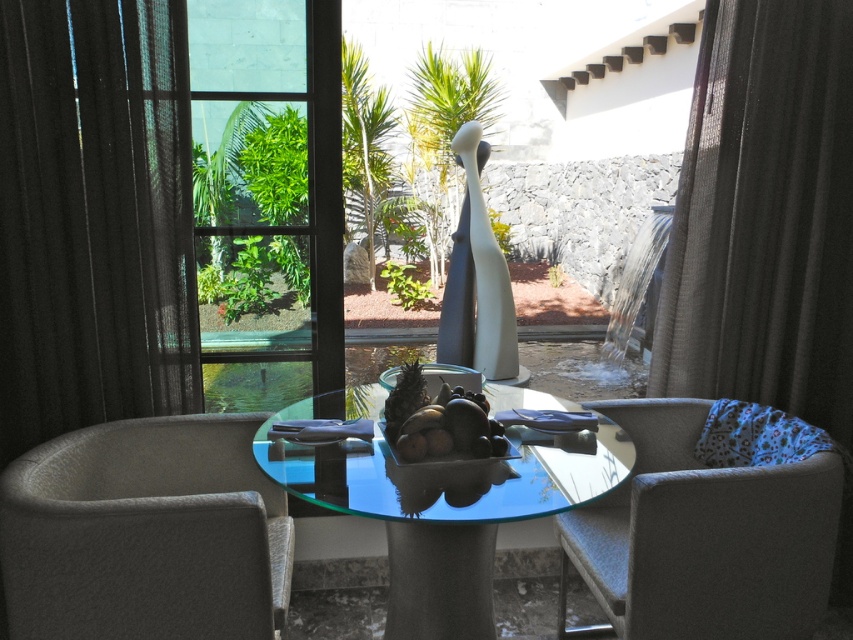
Based on the photo, is black sheer curtain at left bigger than transparent glass door at left?

No, black sheer curtain at left is not bigger than transparent glass door at left.

Is black sheer curtain at left positioned behind transparent glass door at left?

No.

You are a GUI agent. You are given a task and a screenshot of the screen. Output one action in this format:
    pyautogui.click(x=<x>, y=<y>)
    Task: Click on the black sheer curtain at left
    This screenshot has height=640, width=853.
    Given the screenshot: What is the action you would take?
    pyautogui.click(x=93, y=216)

The image size is (853, 640). I want to click on black sheer curtain at left, so click(x=93, y=216).

Who is higher up, transparent glass door at left or transparent glass table at center?

transparent glass door at left

The image size is (853, 640). What do you see at coordinates (265, 198) in the screenshot?
I see `transparent glass door at left` at bounding box center [265, 198].

Find the location of `transparent glass door at left`. transparent glass door at left is located at coordinates (265, 198).

This screenshot has width=853, height=640. I want to click on transparent glass door at left, so click(265, 198).

Does transparent glass door at left have a greater height compared to textured gray armchair at lower left?

Yes, transparent glass door at left is taller than textured gray armchair at lower left.

Can you confirm if transparent glass door at left is shorter than textured gray armchair at lower left?

In fact, transparent glass door at left may be taller than textured gray armchair at lower left.

The height and width of the screenshot is (640, 853). What do you see at coordinates (265, 198) in the screenshot?
I see `transparent glass door at left` at bounding box center [265, 198].

You are a GUI agent. You are given a task and a screenshot of the screen. Output one action in this format:
    pyautogui.click(x=<x>, y=<y>)
    Task: Click on the transparent glass door at left
    The height and width of the screenshot is (640, 853).
    Given the screenshot: What is the action you would take?
    pyautogui.click(x=265, y=198)